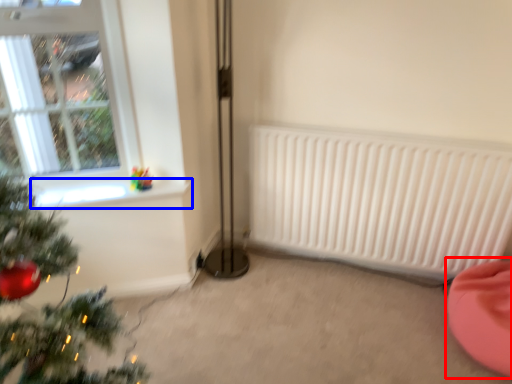
Question: Which of the following is the farthest to the observer, bean bag chair (highlighted by a red box) or window sill (highlighted by a blue box)?

Choices:
 (A) bean bag chair
 (B) window sill

Answer: (B)